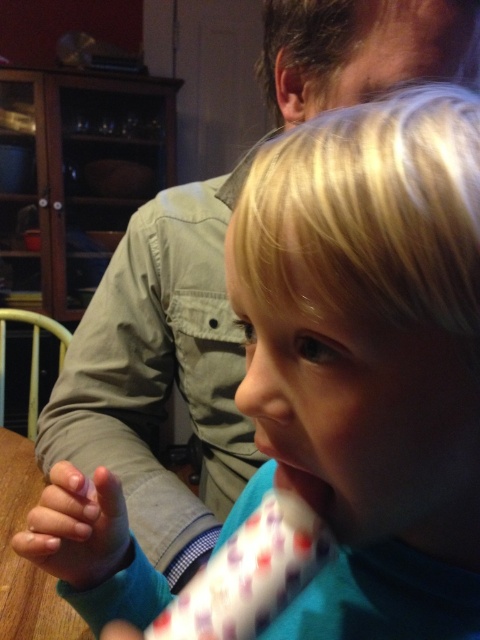
Question: Can you confirm if smooth skin hand at lower left is positioned to the left of matte pink lips at center?

Choices:
 (A) no
 (B) yes

Answer: (B)

Question: Which point is farther to the camera?

Choices:
 (A) smooth skin hand at lower left
 (B) wooden table at lower left

Answer: (B)

Question: Is wooden table at lower left bigger than matte pink lips at center?

Choices:
 (A) no
 (B) yes

Answer: (B)

Question: Among these points, which one is farthest from the camera?

Choices:
 (A) (28, 636)
 (B) (87, 522)

Answer: (A)

Question: Which point is farther from the camera taking this photo?

Choices:
 (A) (7, 544)
 (B) (279, 476)
 (C) (56, 541)

Answer: (A)

Question: In this image, where is wooden table at lower left located relative to matte pink lips at center?

Choices:
 (A) above
 (B) below

Answer: (B)